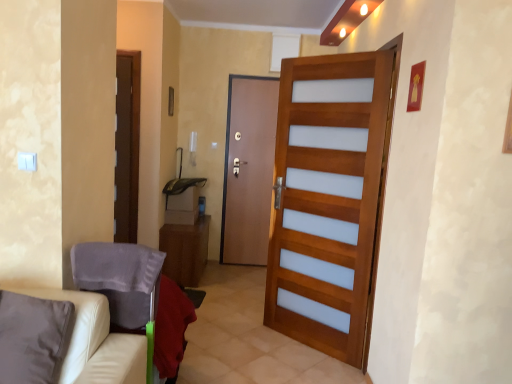
Question: Is white leather armchair at lower left inside or outside of beige leather couch at lower left?

Choices:
 (A) outside
 (B) inside

Answer: (A)

Question: Considering their positions, is white leather armchair at lower left located in front of or behind beige leather couch at lower left?

Choices:
 (A) behind
 (B) front

Answer: (A)

Question: Estimate the real-world distances between objects in this image. Which object is farther from the wooden door at center, the second door from the back?

Choices:
 (A) wooden cabinet at center
 (B) brown wooden door at center, which is the second door in right-to-left order
 (C) beige leather couch at lower left
 (D) white leather armchair at lower left

Answer: (C)

Question: Which object is the farthest from the brown wooden door at center, positioned as the 1th door in left-to-right order?

Choices:
 (A) wooden door at center, the second door in the left-to-right sequence
 (B) white leather armchair at lower left
 (C) wooden cabinet at center
 (D) beige leather couch at lower left

Answer: (D)